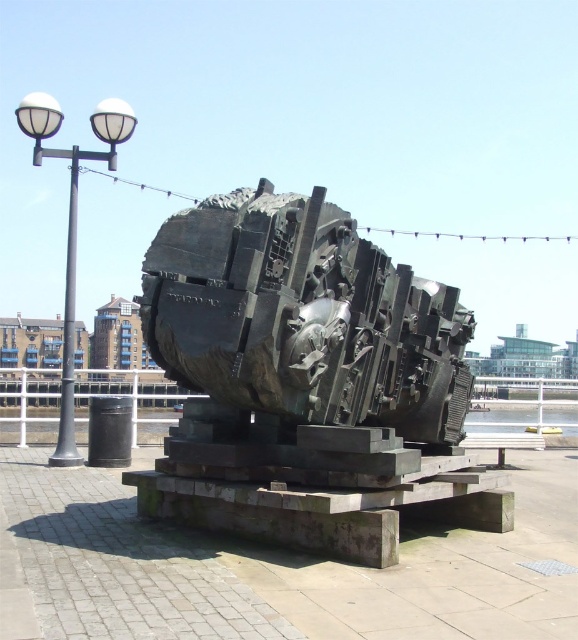
You are standing at the base of the industrial sculpture and want to walk towards the point marked at coordinates point (284, 243) and point (72, 246). Which coordinate point will you reach first?

You will reach point (72, 246) first because point (284, 243) is in front of it, meaning point (72, 246) is closer to your starting position at the base of the sculpture.

You are standing at the camera position and want to take a photo of the bronze sculpture at center. If your camera has a maximum focus range of 5 meters, will it be able to capture the sculpture clearly?

The bronze sculpture at center is 5.20 meters from camera, which is beyond the camera maximum focus range of 5 meters. Therefore, the camera cannot capture the sculpture clearly.

Based on the photo, you are a tourist standing at the entrance of the waterfront promenade. You see the bronze sculpture at center and the white metal lamp post at left. Which object is closer to you?

The bronze sculpture at center is closer to you because it is positioned in front of the white metal lamp post at left.